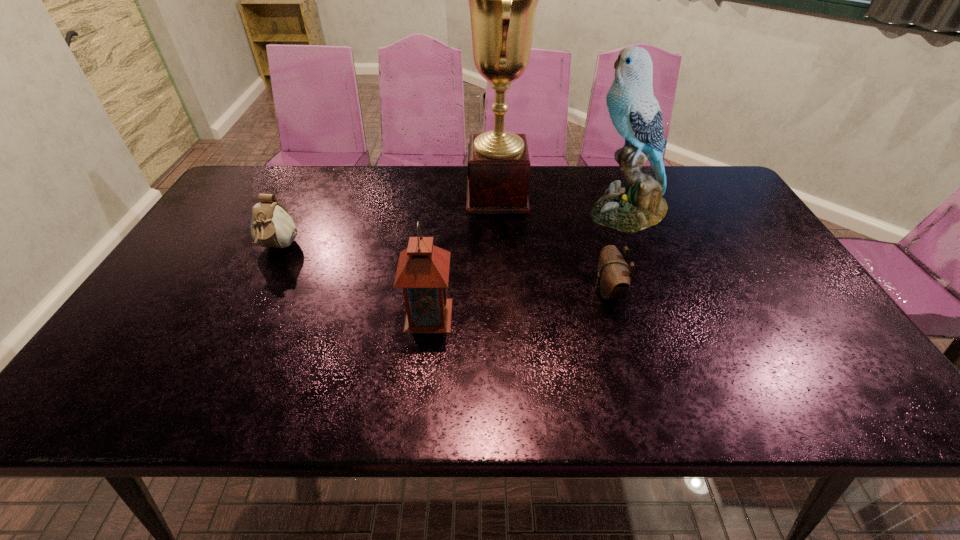
In order to click on free space between the third shortest object and the leftmost object in this screenshot , I will do `click(353, 281)`.

At what (x,y) coordinates should I click in order to perform the action: click on free space between the third tallest object and the shorter pouch. Please return your answer as a coordinate pair (x, y). This screenshot has height=540, width=960. Looking at the image, I should click on (518, 303).

Identify the location of free area in between the parakeet and the leftmost object. The width and height of the screenshot is (960, 540). (452, 230).

I want to click on vacant space that is in between the fourth tallest object and the second tallest object, so click(452, 230).

The height and width of the screenshot is (540, 960). In order to click on free space between the shortest object and the trophy cup in this screenshot , I will do `click(553, 244)`.

Find the location of a particular element. The height and width of the screenshot is (540, 960). vacant area that lies between the third tallest object and the shortest object is located at coordinates (518, 303).

Locate an element on the screen. The height and width of the screenshot is (540, 960). unoccupied position between the right pouch and the tallest object is located at coordinates (553, 244).

The width and height of the screenshot is (960, 540). Find the location of `vacant area that lies between the second object from left to right and the leftmost object`. vacant area that lies between the second object from left to right and the leftmost object is located at coordinates (353, 281).

Select which object is the closest to the lantern. Please provide its 2D coordinates. Your answer should be formatted as a tuple, i.e. [(x, y)], where the tuple contains the x and y coordinates of a point satisfying the conditions above.

[(503, 0)]

What are the coordinates of `object that is the fourth closest to the parakeet` in the screenshot? It's located at (271, 226).